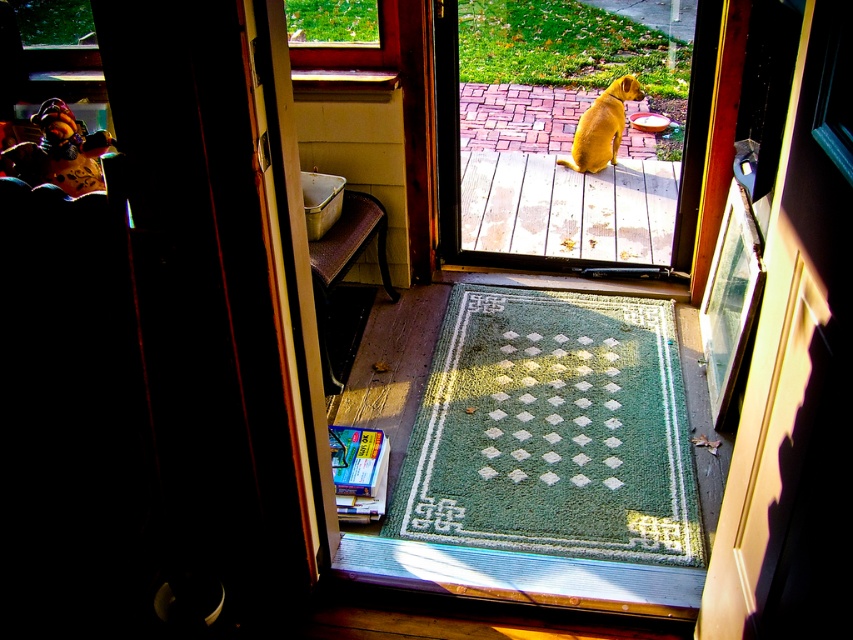
Does yellow fur dog at center have a lesser height compared to golden fur dog at center?

Incorrect, yellow fur dog at center's height does not fall short of golden fur dog at center's.

Between point (560, 76) and point (578, 157), which one is positioned in front?

Positioned in front is point (578, 157).

Who is more distant from viewer, (x=508, y=244) or (x=590, y=160)?

The point (x=590, y=160) is more distant.

The width and height of the screenshot is (853, 640). What are the coordinates of `yellow fur dog at center` in the screenshot? It's located at (561, 138).

Does green textured doormat at center have a lesser height compared to golden fur dog at center?

No.

Is green textured doormat at center smaller than golden fur dog at center?

Incorrect, green textured doormat at center is not smaller in size than golden fur dog at center.

Where is `green textured doormat at center`? This screenshot has width=853, height=640. green textured doormat at center is located at coordinates (552, 429).

I want to click on green textured doormat at center, so click(x=552, y=429).

Does green textured doormat at center appear over yellow fur dog at center?

Actually, green textured doormat at center is below yellow fur dog at center.

You are a GUI agent. You are given a task and a screenshot of the screen. Output one action in this format:
    pyautogui.click(x=<x>, y=<y>)
    Task: Click on the green textured doormat at center
    Image resolution: width=853 pixels, height=640 pixels.
    Given the screenshot: What is the action you would take?
    pyautogui.click(x=552, y=429)

Between point (624, 433) and point (550, 116), which one is positioned behind?

Point (550, 116)

You are a GUI agent. You are given a task and a screenshot of the screen. Output one action in this format:
    pyautogui.click(x=<x>, y=<y>)
    Task: Click on the green textured doormat at center
    
    Given the screenshot: What is the action you would take?
    pyautogui.click(x=552, y=429)